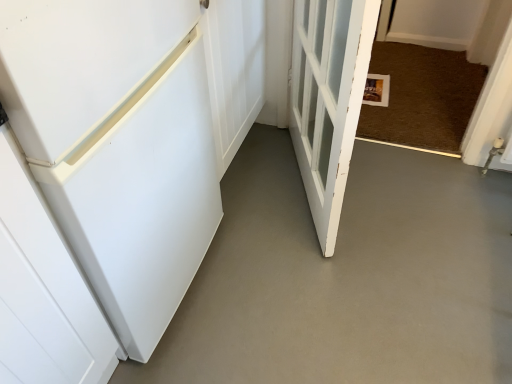
Question: From the image's perspective, is white wooden door at center, which appears as the first door when viewed from the right, located above white matte refrigerator at left, which ranks as the first door in left-to-right order?

Choices:
 (A) no
 (B) yes

Answer: (A)

Question: Considering the relative sizes of white wooden door at center, which appears as the first door when viewed from the right, and white matte refrigerator at left, which ranks as the first door in left-to-right order, in the image provided, is white wooden door at center, which appears as the first door when viewed from the right, taller than white matte refrigerator at left, which ranks as the first door in left-to-right order,?

Choices:
 (A) yes
 (B) no

Answer: (A)

Question: Is white wooden door at center, the second door from the left, wider than white matte refrigerator at left, the 2th door viewed from the right?

Choices:
 (A) yes
 (B) no

Answer: (B)

Question: Considering the relative sizes of white wooden door at center, the second door from the left, and white matte refrigerator at left, the 2th door viewed from the right, in the image provided, is white wooden door at center, the second door from the left, smaller than white matte refrigerator at left, the 2th door viewed from the right,?

Choices:
 (A) yes
 (B) no

Answer: (A)

Question: Is white wooden door at center, the second door from the left, outside white matte refrigerator at left, the 2th door viewed from the right?

Choices:
 (A) yes
 (B) no

Answer: (A)

Question: Is point (398, 226) closer or farther from the camera than point (178, 246)?

Choices:
 (A) closer
 (B) farther

Answer: (B)

Question: Looking at the image, does white smooth concrete at lower left seem bigger or smaller compared to white matte refrigerator at left, the 2th door viewed from the right?

Choices:
 (A) big
 (B) small

Answer: (B)

Question: Considering the positions of white smooth concrete at lower left and white matte refrigerator at left, which ranks as the first door in left-to-right order, in the image, is white smooth concrete at lower left taller or shorter than white matte refrigerator at left, which ranks as the first door in left-to-right order,?

Choices:
 (A) tall
 (B) short

Answer: (B)

Question: From a real-world perspective, is white smooth concrete at lower left positioned above or below white matte refrigerator at left, which ranks as the first door in left-to-right order?

Choices:
 (A) above
 (B) below

Answer: (B)

Question: From the image's perspective, relative to white matte refrigerator at left, the 2th door viewed from the right, is white wooden door at center, the second door from the left, above or below?

Choices:
 (A) above
 (B) below

Answer: (B)

Question: In the image, is white wooden door at center, the second door from the left, positioned in front of or behind white matte refrigerator at left, which ranks as the first door in left-to-right order?

Choices:
 (A) behind
 (B) front

Answer: (B)

Question: From a real-world perspective, relative to white matte refrigerator at left, which ranks as the first door in left-to-right order, is white wooden door at center, the second door from the left, vertically above or below?

Choices:
 (A) below
 (B) above

Answer: (B)

Question: Considering the positions of point (329, 18) and point (172, 264), is point (329, 18) closer or farther from the camera than point (172, 264)?

Choices:
 (A) farther
 (B) closer

Answer: (B)

Question: Considering the positions of white matte refrigerator at left, the 2th door viewed from the right, and white wooden door at center, which appears as the first door when viewed from the right, in the image, is white matte refrigerator at left, the 2th door viewed from the right, wider or thinner than white wooden door at center, which appears as the first door when viewed from the right,?

Choices:
 (A) wide
 (B) thin

Answer: (A)

Question: Is point (170, 54) positioned closer to the camera than point (314, 132)?

Choices:
 (A) farther
 (B) closer

Answer: (B)